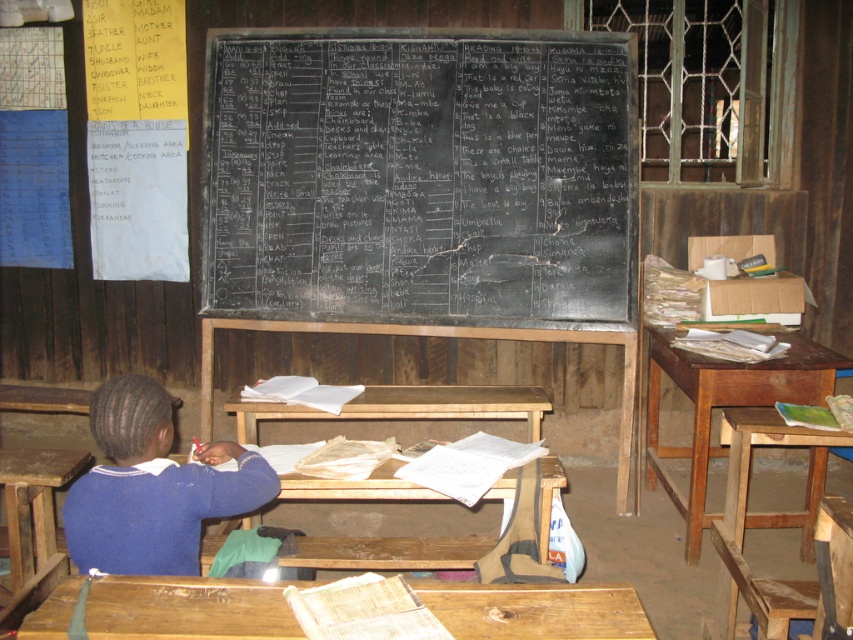
You are a student who wants to write a message on the blackboard. Given that your arm can reach 1 meter, can you comfortably write on the entire surface of the black chalkboard at center while standing at the blue sweater at center?

The black chalkboard at center is wider than the blue sweater at center, so if the student is standing at the blue sweater at center, their arm can reach 1 meter. However, the exact dimensions of the chalkboard aren not provided, so it is uncertain whether the entire surface can be reached. The student may need to move closer or use a different position to access all areas.